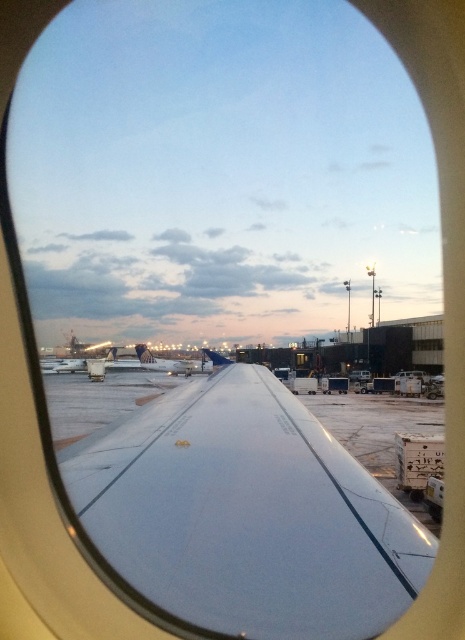
You are a passenger sitting in the airplane and looking at the wing through the window. You notice two points marked on the wing at coordinates point (110, 452) and point (115, 364). Which point is closer to your eyes?

Point (110, 452) is closer to the camera than point (115, 364), so the point (110, 452) is closer to your eyes.

You are a flight attendant who needs to check the size of the white glossy wing at center and the white matte airplane at center. According to the scene, which one is larger?

The white glossy wing at center is smaller than the white matte airplane at center, so the white matte airplane at center is larger.

You are a flight attendant on an airplane and you notice two objects at the center of your view. One is the white glossy wing at center and the other is the white matte airplane at center. Which one is located to the right?

The white glossy wing at center is positioned on the right side of the white matte airplane at center, so the white glossy wing at center is located to the right.